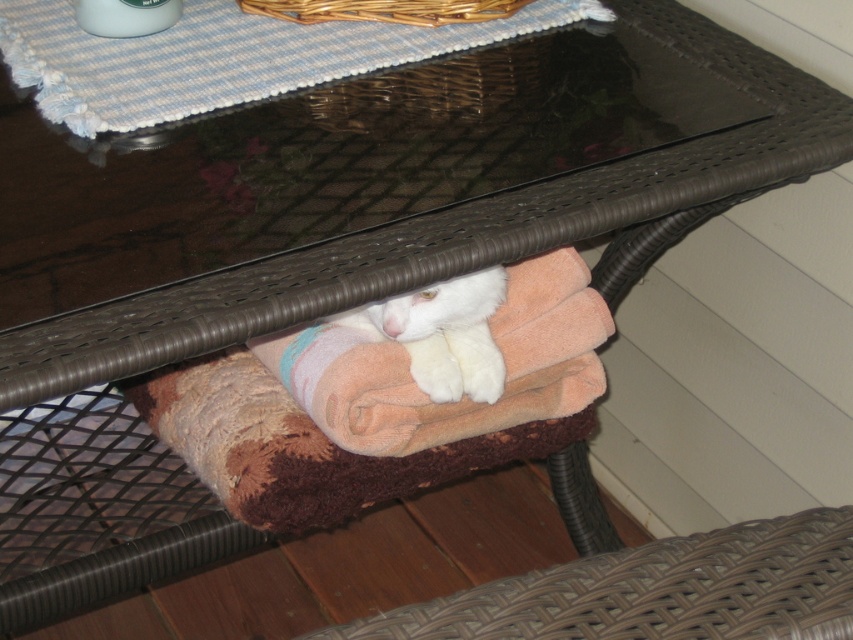
Is the position of soft pink towel at under table more distant than that of white fluffy cat under the table?

Yes, it is behind white fluffy cat under the table.

Can you confirm if soft pink towel at under table is smaller than white fluffy cat under the table?

No.

Identify the location of soft pink towel at under table. (463, 397).

Locate an element on the screen. Image resolution: width=853 pixels, height=640 pixels. soft pink towel at under table is located at coordinates (463, 397).

Is white fluffy cat under the table to the right of woven wicker basket at upper center from the viewer's perspective?

Correct, you'll find white fluffy cat under the table to the right of woven wicker basket at upper center.

Consider the image. Is white fluffy cat under the table smaller than woven wicker basket at upper center?

No.

Where is `white fluffy cat under the table`? The image size is (853, 640). white fluffy cat under the table is located at coordinates (444, 333).

The height and width of the screenshot is (640, 853). Find the location of `white fluffy cat under the table`. white fluffy cat under the table is located at coordinates (444, 333).

Does blue woven placemat at upper center lie in front of woven wicker basket at upper center?

Yes, blue woven placemat at upper center is closer to the viewer.

Which is in front, point (175, 76) or point (476, 19)?

Point (175, 76) is in front.

Which is in front, point (10, 70) or point (428, 22)?

Point (10, 70) is more forward.

Identify the location of blue woven placemat at upper center. (221, 56).